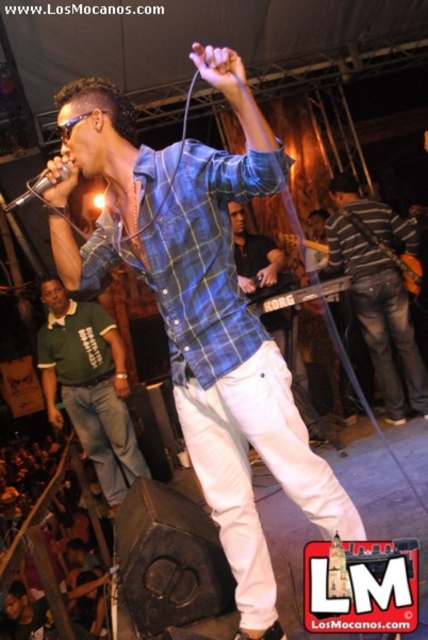
Does striped cotton shirt at center have a greater width compared to matte black keyboard at center?

Incorrect, striped cotton shirt at center's width does not surpass matte black keyboard at center's.

Can you confirm if striped cotton shirt at center is positioned to the left of matte black keyboard at center?

Incorrect, striped cotton shirt at center is not on the left side of matte black keyboard at center.

Which is in front, point (351, 225) or point (237, 266)?

Point (351, 225)

This screenshot has height=640, width=428. Identify the location of striped cotton shirt at center. (377, 291).

Which is above, matte black keyboard at center or wooden electric guitar at center?

Positioned higher is wooden electric guitar at center.

Does matte black keyboard at center come in front of wooden electric guitar at center?

Yes.

Find the location of `matte black keyboard at center`. matte black keyboard at center is located at coordinates (256, 259).

This screenshot has height=640, width=428. Identify the location of matte black keyboard at center. (256, 259).

Image resolution: width=428 pixels, height=640 pixels. What do you see at coordinates (89, 387) in the screenshot? I see `green polo shirt at left` at bounding box center [89, 387].

Is green polo shirt at left in front of wooden electric guitar at center?

That is False.

At what (x,y) coordinates should I click in order to perform the action: click on green polo shirt at left. Please return your answer as a coordinate pair (x, y). The width and height of the screenshot is (428, 640). Looking at the image, I should click on (89, 387).